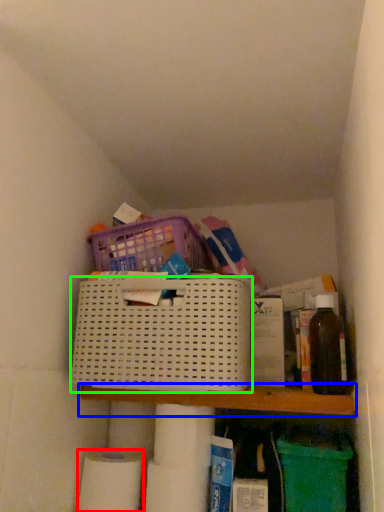
Question: Estimate the real-world distances between objects in this image. Which object is farther from toilet paper (highlighted by a red box), shelf (highlighted by a blue box) or basket (highlighted by a green box)?

Choices:
 (A) shelf
 (B) basket

Answer: (B)